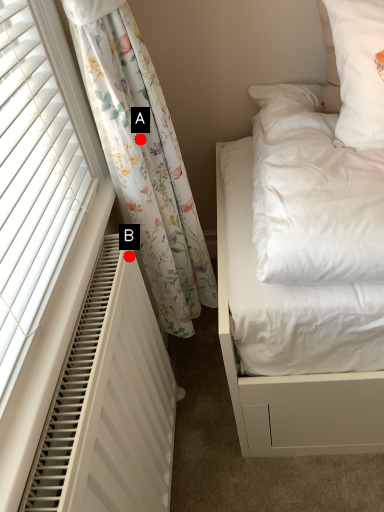
Question: Two points are circled on the image, labeled by A and B beside each circle. Which of the following is the farthest from the observer?

Choices:
 (A) A is further
 (B) B is further

Answer: (B)